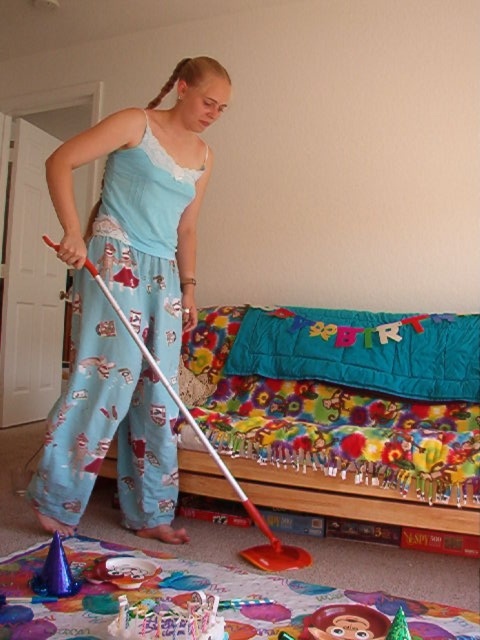
You are a delivery robot trying to place a gift box between the light blue satin pajama set at center and the floral fabric bed at center. The gift box is 25 inches long. Can you fit it between them?

The light blue satin pajama set at center and floral fabric bed at center are 24.92 inches apart from each other. The gift box is 25 inches long, so it cannot fit between them as the space is slightly smaller than the box.

You are organizing a birthday party in the bedroom and need to place a rectangular cake box that is 10 cm thick. The light blue satin pajama set at center and the floral fabric bed at center are both in the way. Which object can you move to make space for the cake box without needing to move the other?

The light blue satin pajama set at center is thinner than the floral fabric bed at center, so you can move the light blue satin pajama set at center to make space for the cake box since it requires less clearance.